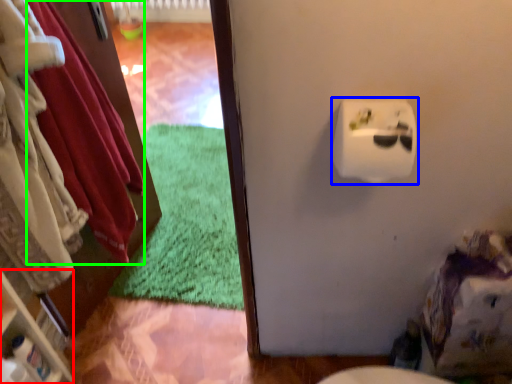
Question: Considering the real-world distances, which object is farthest from shelf (highlighted by a red box)? toilet paper (highlighted by a blue box) or clothing (highlighted by a green box)?

Choices:
 (A) toilet paper
 (B) clothing

Answer: (A)